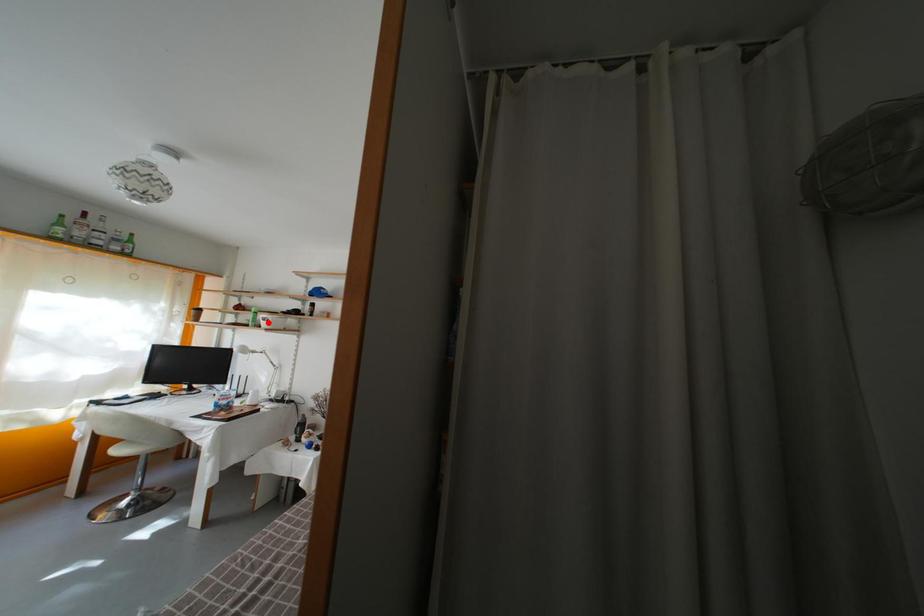
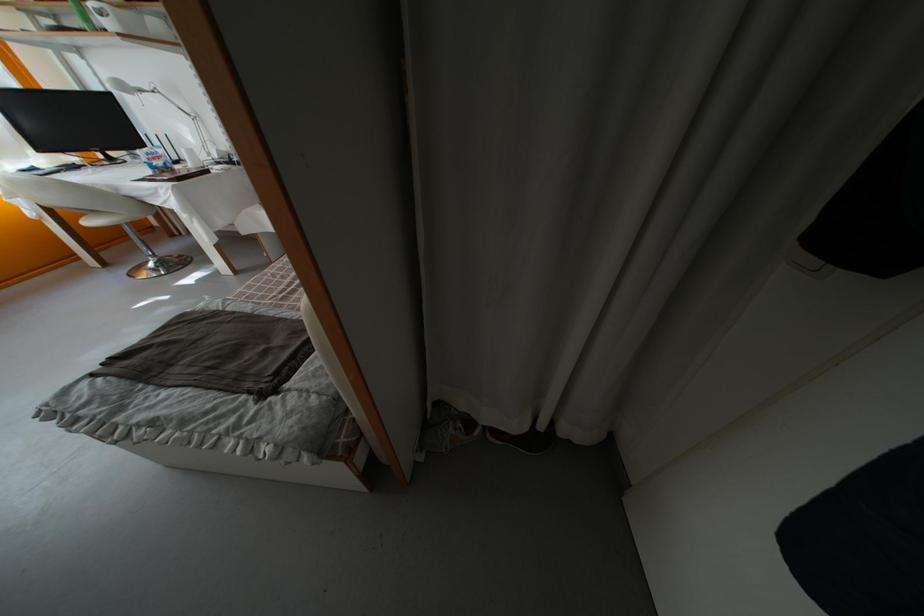
Question: I am providing you with two images of the same scene from different viewpoints. Given a red point in image1, look at the same physical point in image2. Is it:

Choices:
 (A) Closer to the viewpoint
 (B) Farther from the viewpoint

Answer: (B)